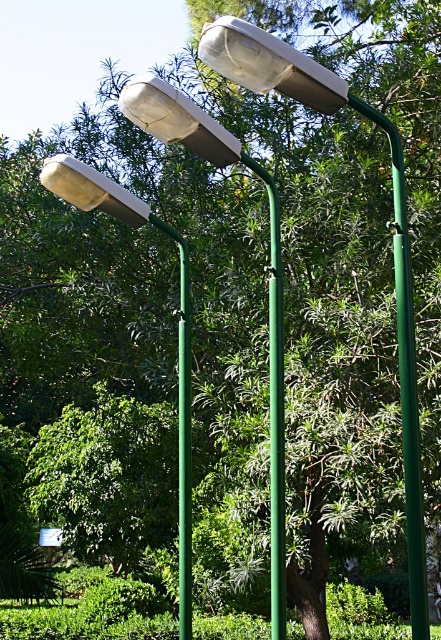
You are a maintenance worker checking the street lamps. You notice that the white glossy street light at center and the green matte pole at center are positioned in a certain way. From your perspective standing in front of them, which object is on the left side?

The white glossy street light at center is to the left of the green matte pole at center, so it is on the left side from your perspective.

You are a city planner evaluating the placement of the white glossy street light at center and the green matte pole at center in the park. Based on their heights, which one would require a higher mounting point to ensure proper visibility for pedestrians?

The white glossy street light at center is taller than the green matte pole at center, so it would require a higher mounting point to ensure proper visibility for pedestrians.

You are a maintenance worker needing to inspect both the white glossy street light at center and the matte white street light at left. Which one should you check first if you want to start with the one closer to your current position?

You should check the white glossy street light at center first because it is in front of the matte white street light at left, meaning it is closer to your current position.